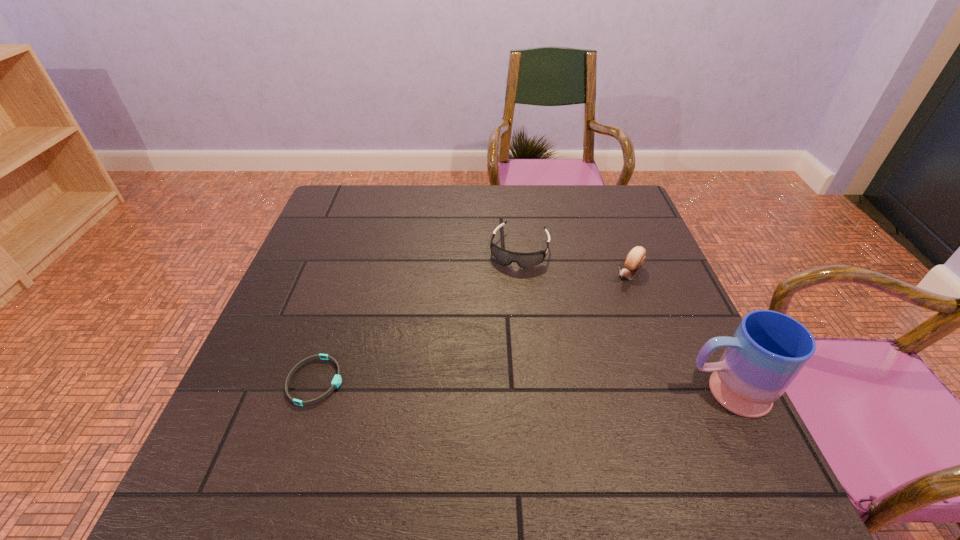
Find the location of `escargot that is at the right edge`. escargot that is at the right edge is located at coordinates (635, 259).

The height and width of the screenshot is (540, 960). In order to click on object situated at the near left corner in this screenshot , I will do `click(337, 379)`.

The image size is (960, 540). I want to click on object present at the near right corner, so [768, 350].

At what (x,y) coordinates should I click in order to perform the action: click on free space at the far edge. Please return your answer as a coordinate pair (x, y). The height and width of the screenshot is (540, 960). Looking at the image, I should click on (563, 213).

This screenshot has height=540, width=960. In the image, there is a desktop. What are the coordinates of `vacant space at the near edge` in the screenshot? It's located at (585, 435).

This screenshot has height=540, width=960. Identify the location of vacant area at the left edge. (312, 233).

Locate an element on the screen. vacant space at the right edge is located at coordinates (668, 301).

Find the location of `free space at the far left corner`. free space at the far left corner is located at coordinates (331, 198).

The image size is (960, 540). I want to click on vacant space at the far right corner of the desktop, so click(x=593, y=207).

I want to click on vacant area that lies between the tallest object and the leftmost object, so click(x=520, y=387).